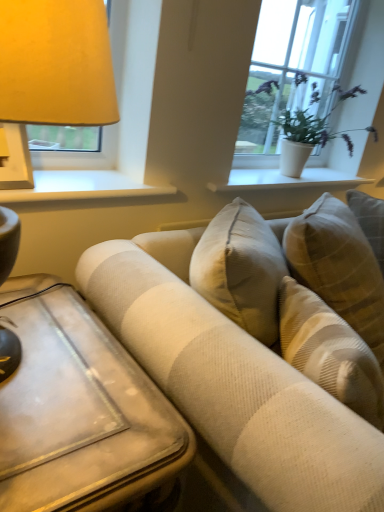
Question: Does white painted wood at upper left, the 2th window sill positioned from the back, have a larger size compared to beige textured couch at center?

Choices:
 (A) yes
 (B) no

Answer: (B)

Question: Can you confirm if white painted wood at upper left, the 2th window sill when ordered from right to left, is thinner than beige textured couch at center?

Choices:
 (A) yes
 (B) no

Answer: (A)

Question: Is white painted wood at upper left, arranged as the first window sill when viewed from the left, not close to beige textured couch at center?

Choices:
 (A) yes
 (B) no

Answer: (B)

Question: Does white painted wood at upper left, the 2th window sill positioned from the back, appear on the right side of beige textured couch at center?

Choices:
 (A) yes
 (B) no

Answer: (B)

Question: Does white painted wood at upper left, arranged as the first window sill when viewed from the left, contain beige textured couch at center?

Choices:
 (A) yes
 (B) no

Answer: (B)

Question: Does white painted wood at upper left, which is the first window sill from front to back, appear on the left side of beige textured couch at center?

Choices:
 (A) yes
 (B) no

Answer: (A)

Question: Does wooden table at lower left have a lesser width compared to white ceramic vase at upper center, the 2th window sill viewed from the front?

Choices:
 (A) no
 (B) yes

Answer: (A)

Question: From the image's perspective, is wooden table at lower left located beneath white ceramic vase at upper center, which appears as the 1th window sill when viewed from the right?

Choices:
 (A) no
 (B) yes

Answer: (B)

Question: From a real-world perspective, is wooden table at lower left located higher than white ceramic vase at upper center, the 2th window sill viewed from the front?

Choices:
 (A) yes
 (B) no

Answer: (B)

Question: From the image's perspective, is wooden table at lower left located above white ceramic vase at upper center, marked as the first window sill in a back-to-front arrangement?

Choices:
 (A) yes
 (B) no

Answer: (B)

Question: Does wooden table at lower left have a greater height compared to white ceramic vase at upper center, the 2th window sill viewed from the front?

Choices:
 (A) yes
 (B) no

Answer: (A)

Question: Is wooden table at lower left in contact with white ceramic vase at upper center, which is the second window sill in left-to-right order?

Choices:
 (A) no
 (B) yes

Answer: (A)

Question: Can you confirm if beige textured couch at center is positioned to the right of white ceramic vase at upper center, which is the second window sill in left-to-right order?

Choices:
 (A) no
 (B) yes

Answer: (B)